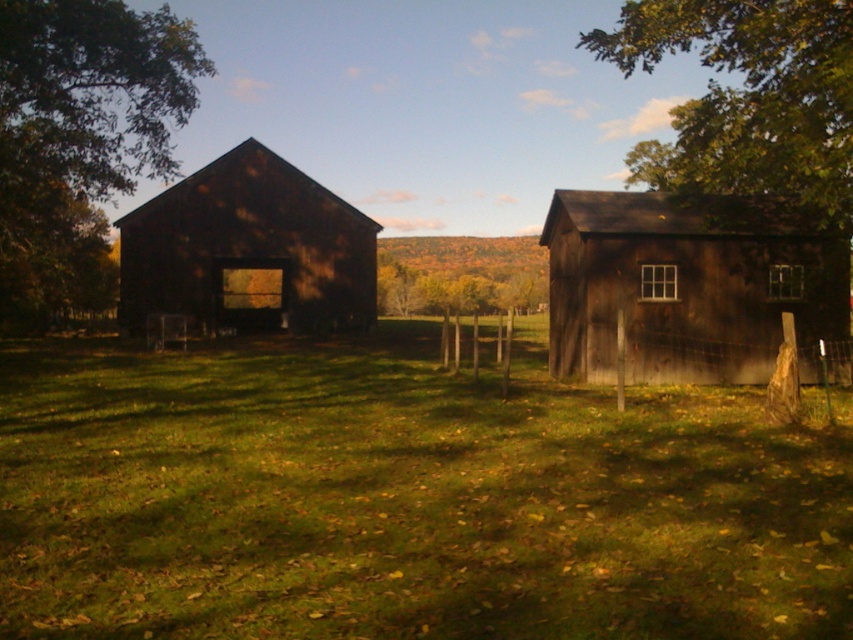
You are standing in the middle of the field between the two wooden structures. You see two points marked in the image, point 1 at coordinates point (305,426) and point 2 at coordinates point (657,305). Which point is closer to you?

Point (305,426) is closer to the viewer than point (657,305), so point 1 is closer to you.

You are standing in the middle of a grassy field and see the dark wood barn at right and the green leafy tree at left. Which object is located to your right side?

The dark wood barn at right is positioned on the right side of green leafy tree at left, so from your perspective in the middle of the field, the dark wood barn at right would be to your right side.